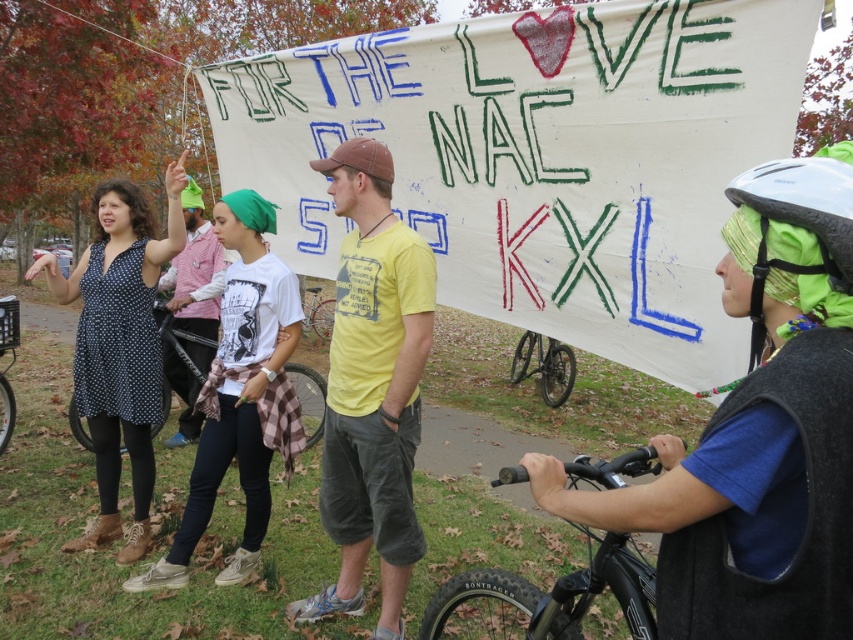
Question: Based on their relative distances, which object is nearer to the white matte bicycle helmet at right?

Choices:
 (A) polka dot dress at center
 (B) white cotton t-shirt at center
 (C) black matte bicycle at center
 (D) metallic silver bicycle at center

Answer: (B)

Question: Is polka dot dress at left below black matte bicycle at lower right?

Choices:
 (A) yes
 (B) no

Answer: (B)

Question: Which of these objects is positioned closest to the yellow cotton t-shirt at center?

Choices:
 (A) white cotton t-shirt at center
 (B) black matte bicycle at center
 (C) blue fleece helmet at upper right
 (D) black matte bicycle at lower center

Answer: (A)

Question: In this image, where is white matte bicycle helmet at right located relative to polka dot dress at center?

Choices:
 (A) above
 (B) below

Answer: (A)

Question: Can you confirm if white matte bicycle helmet at right is positioned to the right of black matte bicycle at lower center?

Choices:
 (A) yes
 (B) no

Answer: (B)

Question: Which point is closer to the camera taking this photo?

Choices:
 (A) (306, 385)
 (B) (146, 518)
 (C) (254, 228)

Answer: (C)